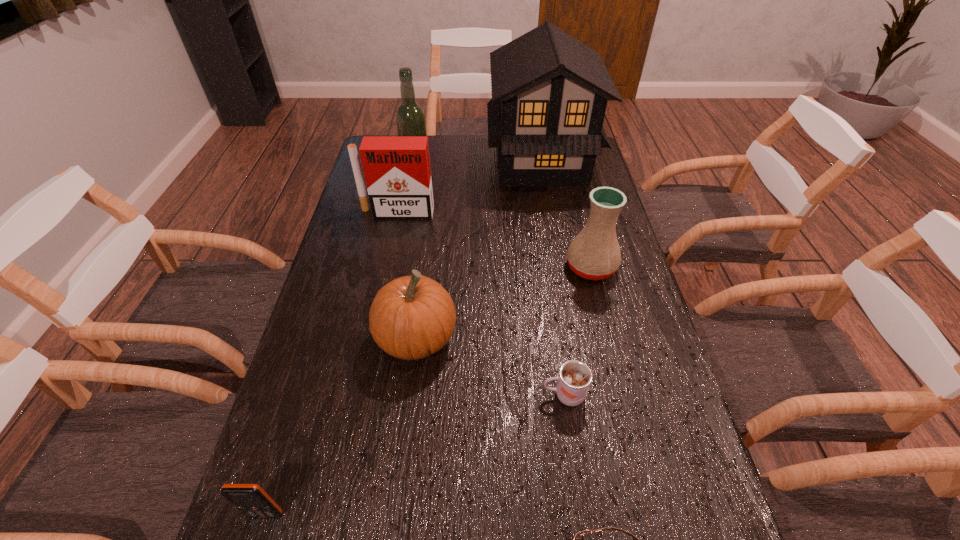
I want to click on liquor that is at the far edge, so click(x=410, y=118).

The height and width of the screenshot is (540, 960). I want to click on liquor located in the left edge section of the desktop, so click(410, 118).

Where is `cigarette case that is at the left edge`? cigarette case that is at the left edge is located at coordinates (397, 171).

The width and height of the screenshot is (960, 540). What are the coordinates of `cellular telephone positioned at the left edge` in the screenshot? It's located at (250, 499).

I want to click on dollhouse at the right edge, so click(549, 91).

At what (x,y) coordinates should I click in order to perform the action: click on pottery that is at the right edge. Please return your answer as a coordinate pair (x, y). This screenshot has width=960, height=540. Looking at the image, I should click on (594, 254).

Find the location of a particular element. object present at the far left corner is located at coordinates (410, 118).

Locate an element on the screen. object located in the far right corner section of the desktop is located at coordinates (549, 91).

In the image, there is a desktop. Identify the location of blank space at the far edge. (430, 161).

In the image, there is a desktop. Where is `vacant space at the left edge`? vacant space at the left edge is located at coordinates (381, 271).